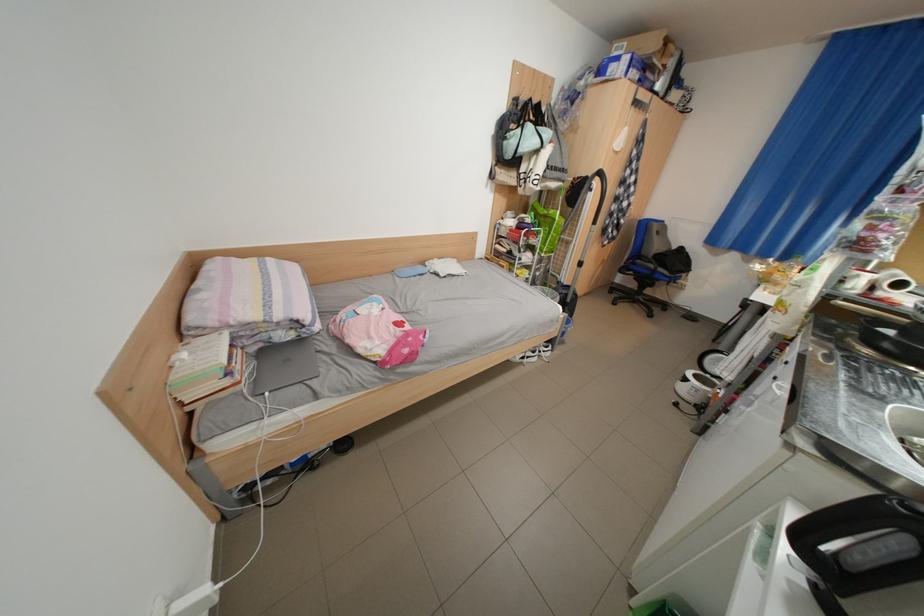
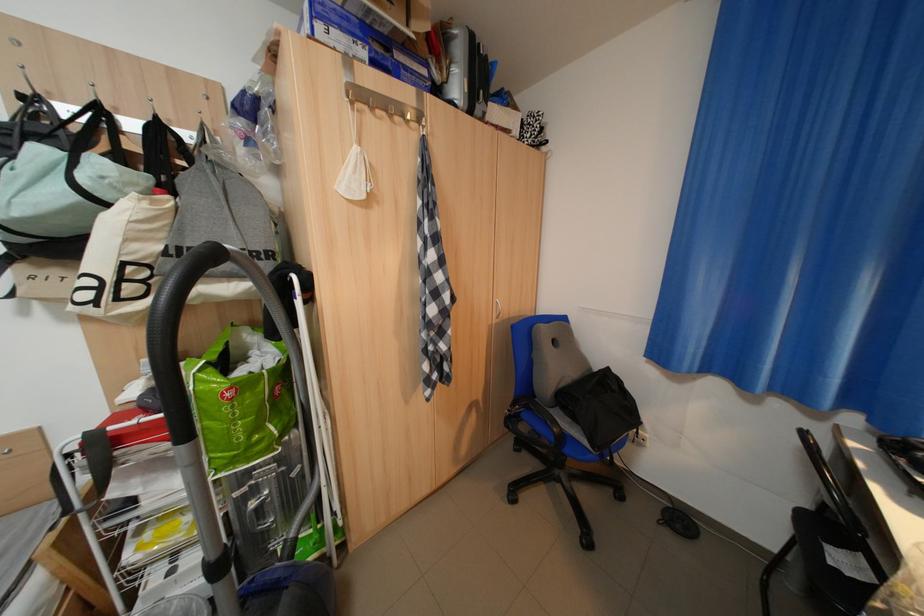
What movement of the cameraman would produce the second image?

The cameraman moved toward right, forward.